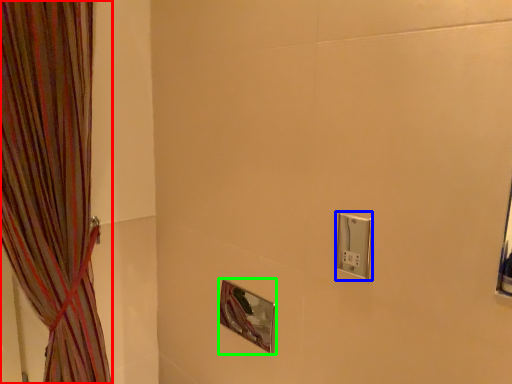
Question: Based on their relative distances, which object is farther from curtain (highlighted by a red box)? Choose from light switch (highlighted by a blue box) and mirror (highlighted by a green box).

Choices:
 (A) light switch
 (B) mirror

Answer: (A)